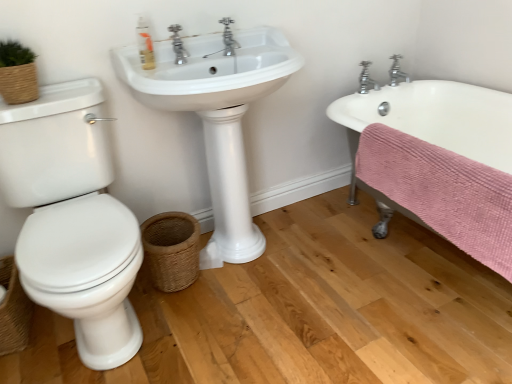
Where is `free point to the right of woven brown basket at lower left, marked as the second basket in a right-to-left arrangement`? free point to the right of woven brown basket at lower left, marked as the second basket in a right-to-left arrangement is located at coordinates (52, 337).